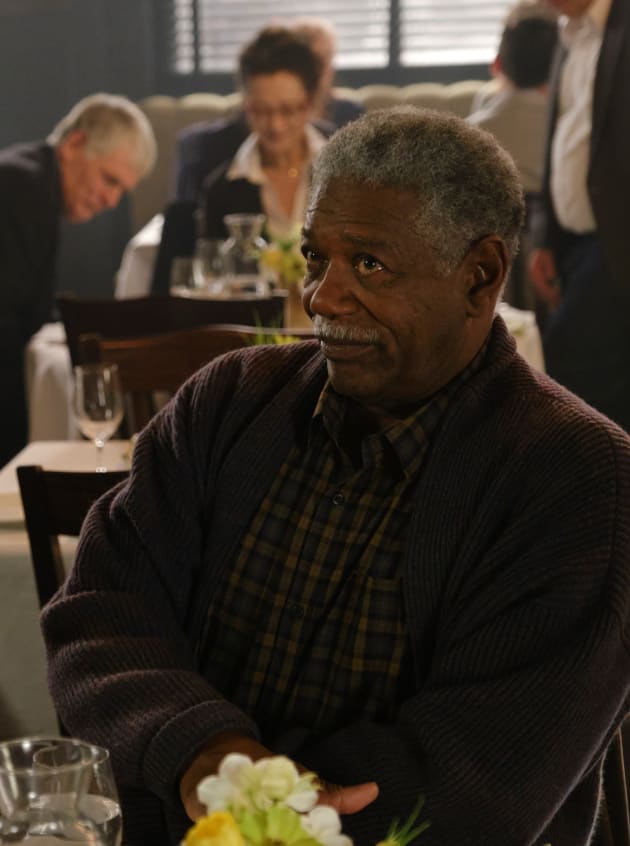
I want to click on dark chairs, so click(x=166, y=360), click(x=139, y=312), click(x=69, y=492).